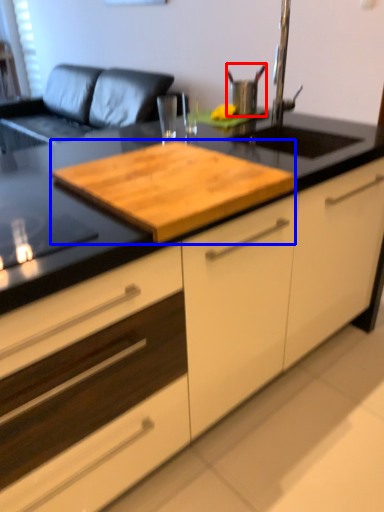
Question: Which object is closer to the camera taking this photo, appliance (highlighted by a red box) or wood (highlighted by a blue box)?

Choices:
 (A) appliance
 (B) wood

Answer: (B)